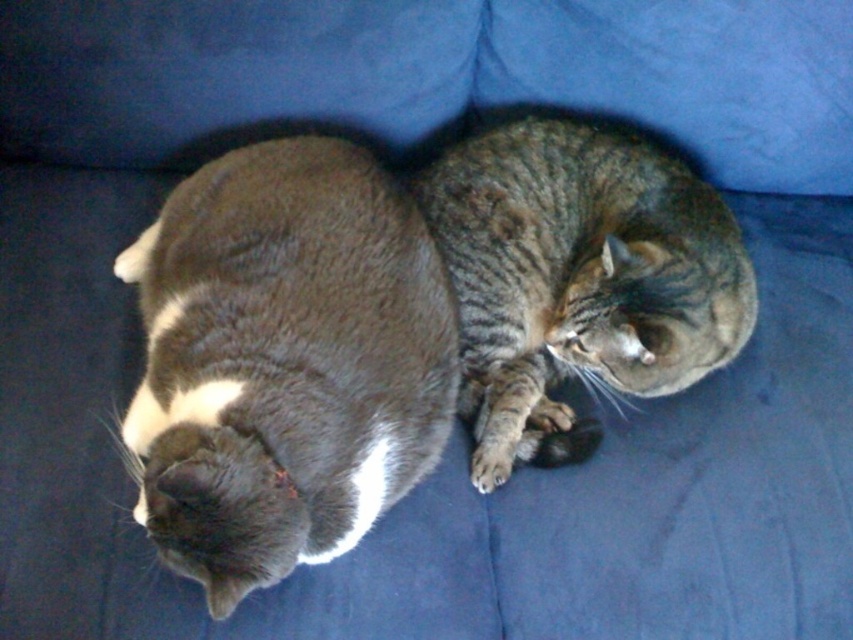
Question: Is gray fur cat at center bigger than tabby fur cat at center?

Choices:
 (A) no
 (B) yes

Answer: (B)

Question: Among these points, which one is nearest to the camera?

Choices:
 (A) [251, 538]
 (B) [622, 164]

Answer: (A)

Question: Among these objects, which one is nearest to the camera?

Choices:
 (A) gray fur cat at center
 (B) tabby fur cat at center

Answer: (A)

Question: Does gray fur cat at center have a greater width compared to tabby fur cat at center?

Choices:
 (A) yes
 (B) no

Answer: (B)

Question: Does gray fur cat at center have a lesser width compared to tabby fur cat at center?

Choices:
 (A) yes
 (B) no

Answer: (A)

Question: Which point appears farthest from the camera in this image?

Choices:
 (A) (677, 204)
 (B) (253, 186)

Answer: (A)